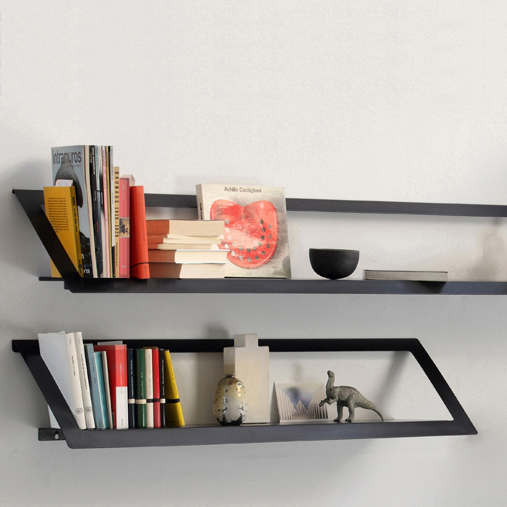
This screenshot has height=507, width=507. I want to click on decorative object, so click(x=233, y=400), click(x=251, y=376), click(x=332, y=265), click(x=349, y=396), click(x=289, y=401).